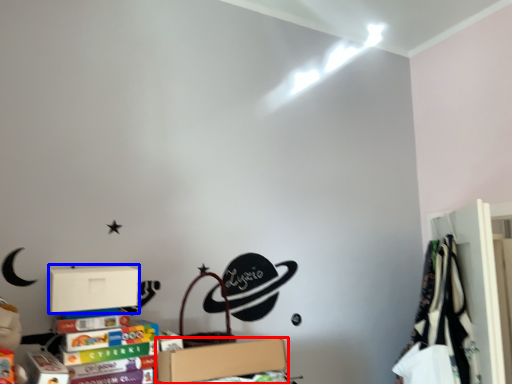
Question: Which object appears farthest to the camera in this image, box (highlighted by a red box) or cardboard box (highlighted by a blue box)?

Choices:
 (A) box
 (B) cardboard box

Answer: (B)